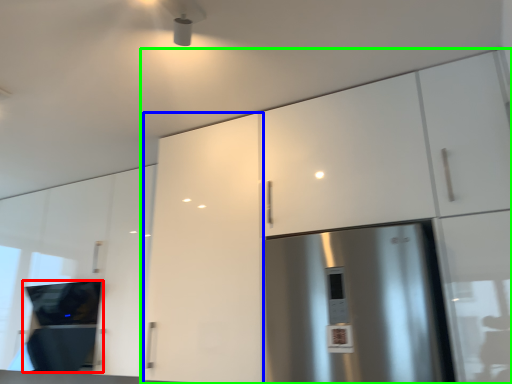
Question: Considering the real-world distances, which object is closest to appliance (highlighted by a red box)? cabinetry (highlighted by a blue box) or cabinetry (highlighted by a green box).

Choices:
 (A) cabinetry
 (B) cabinetry

Answer: (A)